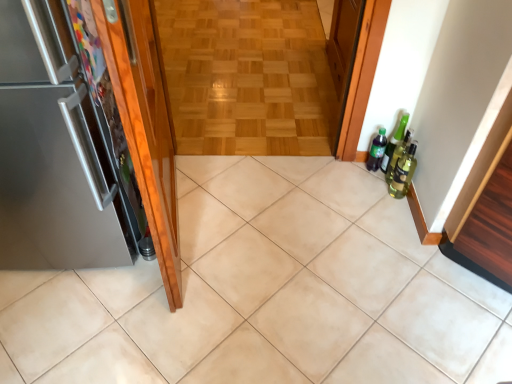
This screenshot has width=512, height=384. I want to click on vacant space in between shiny wood door at left, arranged as the first door when viewed from the right, and green matte bottle at right, so click(x=267, y=202).